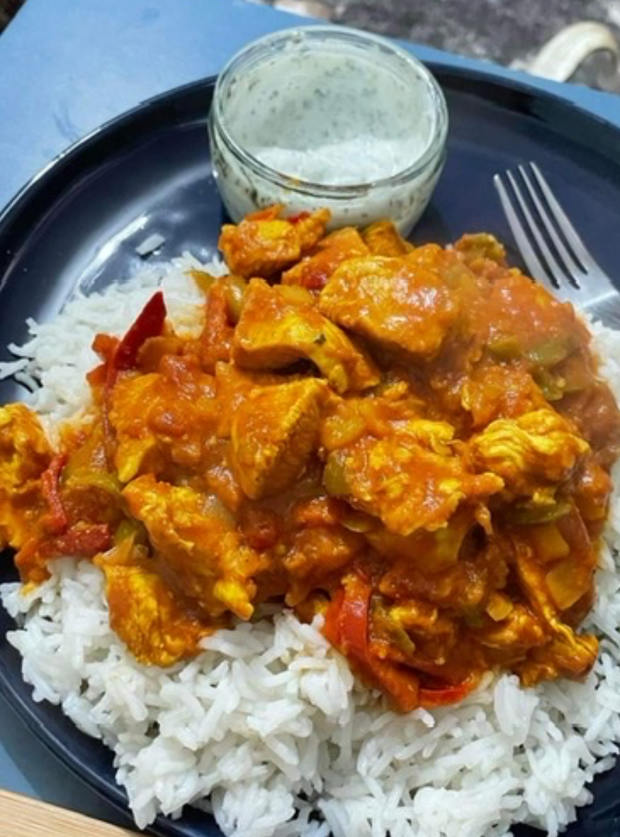
The height and width of the screenshot is (837, 620). Find the location of `floor`. floor is located at coordinates (462, 23).